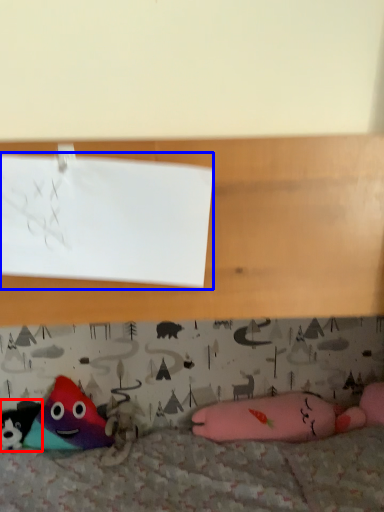
Question: Which object is further to the camera taking this photo, toy (highlighted by a red box) or paper (highlighted by a blue box)?

Choices:
 (A) toy
 (B) paper

Answer: (A)